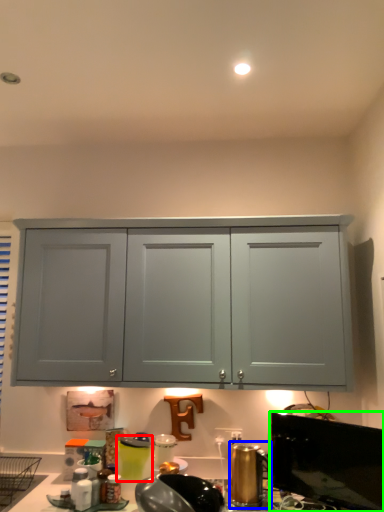
Question: Estimate the real-world distances between objects in this image. Which object is closer to appliance (highlighted by a red box), appliance (highlighted by a blue box) or window screen (highlighted by a green box)?

Choices:
 (A) appliance
 (B) window screen

Answer: (A)